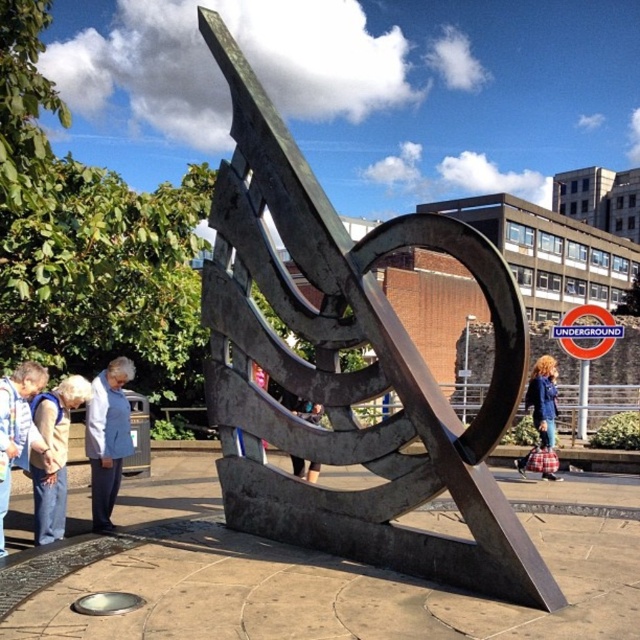
You are a fashion designer observing a public space with a modern sculpture and a nearby Underground station. You notice two jackets displayed on mannequins. The jackets are labeled as the light blue denim jacket at lower left and the blue denim jacket at center. Which jacket is larger in size?

The light blue denim jacket at lower left is bigger than the blue denim jacket at center.

You are standing at point (349,371) in the public space. What object are you standing on?

You are standing on the polished bronze sculpture at center located at point (349,371).

You are standing in the public space looking at the sculpture. You see a light blue fabric jacket at lower left and a light beige fabric at lower left. Which one is closer to you?

The light blue fabric jacket at lower left is closer to you because it is further to the viewer than the light beige fabric at lower left.